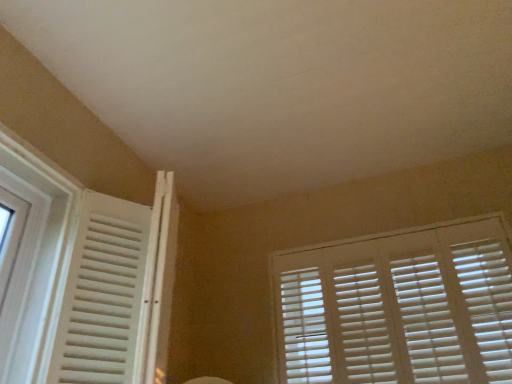
At what (x,y) coordinates should I click in order to perform the action: click on white matte window blind at upper right. Please return your answer as a coordinate pair (x, y). The height and width of the screenshot is (384, 512). Looking at the image, I should click on (399, 308).

In order to face white matte window blind at upper right, should I rotate leftwards or rightwards?

You should rotate right by 17.569 degrees.

Describe the element at coordinates (399, 308) in the screenshot. The image size is (512, 384). I see `white matte window blind at upper right` at that location.

Measure the distance between point (508, 284) and camera.

A distance of 1.84 meters exists between point (508, 284) and camera.

Describe the element at coordinates (82, 279) in the screenshot. I see `white wooden window at left` at that location.

You are a GUI agent. You are given a task and a screenshot of the screen. Output one action in this format:
    pyautogui.click(x=<x>, y=<y>)
    Task: Click on the white wooden window at left
    Image resolution: width=512 pixels, height=384 pixels.
    Given the screenshot: What is the action you would take?
    pyautogui.click(x=82, y=279)

Identify the location of white matte window blind at upper right. (399, 308).

In the scene shown: Can you confirm if white matte window blind at upper right is positioned to the left of white wooden window at left?

No.

Is white matte window blind at upper right positioned before white wooden window at left?

No, it is not.

Does point (284, 311) come behind point (8, 347)?

Yes, point (284, 311) is behind point (8, 347).

From the image's perspective, between white matte window blind at upper right and white wooden window at left, who is located below?

From the image's view, white matte window blind at upper right is below.

From a real-world perspective, is white matte window blind at upper right over white wooden window at left?

Yes.

Does white matte window blind at upper right have a lesser width compared to white wooden window at left?

Indeed, white matte window blind at upper right has a lesser width compared to white wooden window at left.

Does white matte window blind at upper right have a lesser height compared to white wooden window at left?

Yes, white matte window blind at upper right is shorter than white wooden window at left.

Considering the relative sizes of white matte window blind at upper right and white wooden window at left in the image provided, is white matte window blind at upper right smaller than white wooden window at left?

Indeed, white matte window blind at upper right has a smaller size compared to white wooden window at left.

Would you say white matte window blind at upper right is inside or outside white wooden window at left?

white matte window blind at upper right is spatially situated outside white wooden window at left.

Is white matte window blind at upper right directly adjacent to white wooden window at left?

No, white matte window blind at upper right is not touching white wooden window at left.

Is white matte window blind at upper right oriented away from white wooden window at left?

No, white matte window blind at upper right is not facing away from white wooden window at left.

What's the angular difference between white matte window blind at upper right and white wooden window at left's facing directions?

The angle between the facing direction of white matte window blind at upper right and the facing direction of white wooden window at left is 87.8 degrees.

Find the location of `window on the left of white matte window blind at upper right`. window on the left of white matte window blind at upper right is located at coordinates (82, 279).

Between white wooden window at left and white matte window blind at upper right, which one appears on the left side from the viewer's perspective?

white wooden window at left.

Is white wooden window at left closer to camera compared to white matte window blind at upper right?

Yes, white wooden window at left is closer to the camera.

Which is closer to the camera, (49,302) or (458,343)?

Point (49,302).

From the image's perspective, does white wooden window at left appear higher than white matte window blind at upper right?

Yes, from the image's perspective, white wooden window at left is over white matte window blind at upper right.

From a real-world perspective, is white wooden window at left below white matte window blind at upper right?

Correct, in the physical world, white wooden window at left is lower than white matte window blind at upper right.

Considering the relative sizes of white wooden window at left and white matte window blind at upper right in the image provided, is white wooden window at left thinner than white matte window blind at upper right?

No.

Considering the sizes of objects white wooden window at left and white matte window blind at upper right in the image provided, who is shorter, white wooden window at left or white matte window blind at upper right?

white matte window blind at upper right.

Between white wooden window at left and white matte window blind at upper right, which one has larger size?

white wooden window at left is bigger.

Is white matte window blind at upper right a part of white wooden window at left?

No, white wooden window at left does not contain white matte window blind at upper right.

Is white wooden window at left not close to white matte window blind at upper right?

Yes, white wooden window at left and white matte window blind at upper right are located far from each other.

Is white matte window blind at upper right at the back of white wooden window at left?

No, white matte window blind at upper right is not at the back of white wooden window at left.

Locate an element on the screen. This screenshot has width=512, height=384. window blind below the white wooden window at left (from the image's perspective) is located at coordinates (399, 308).

This screenshot has width=512, height=384. I want to click on window blind below the white wooden window at left (from the image's perspective), so click(399, 308).

Locate an element on the screen. The height and width of the screenshot is (384, 512). window that is under the white matte window blind at upper right (from a real-world perspective) is located at coordinates (82, 279).